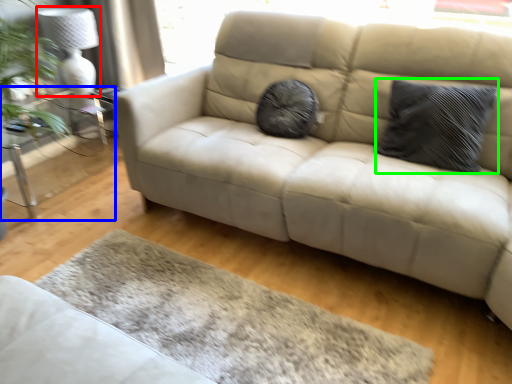
Question: Based on their relative distances, which object is farther from lamp (highlighted by a red box)? Choose from table (highlighted by a blue box) and pillow (highlighted by a green box).

Choices:
 (A) table
 (B) pillow

Answer: (B)